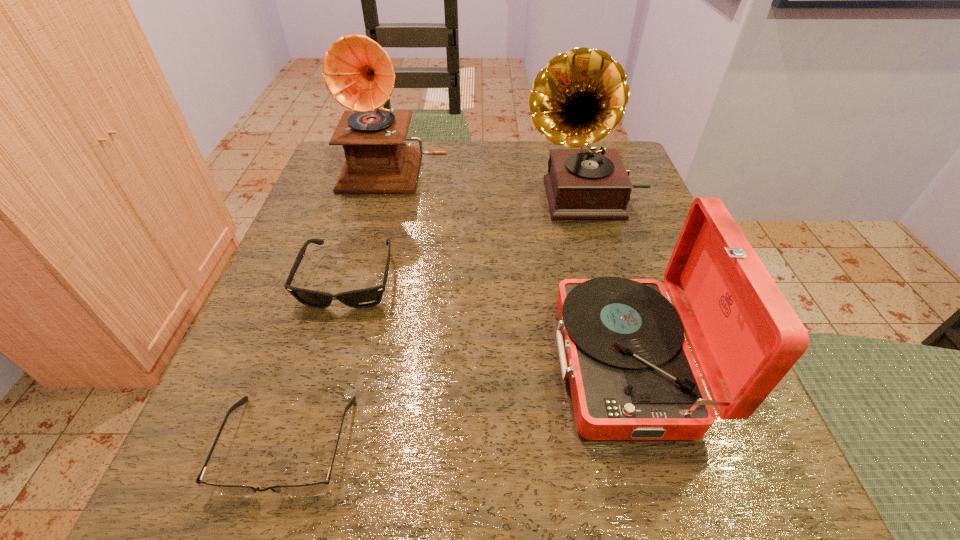
The height and width of the screenshot is (540, 960). Identify the location of free space at the near edge of the desktop. (495, 459).

Identify the location of free region at the left edge of the desktop. This screenshot has width=960, height=540. (326, 289).

At what (x,y) coordinates should I click in order to perform the action: click on vacant space at the right edge. Please return your answer as a coordinate pair (x, y). Image resolution: width=960 pixels, height=540 pixels. Looking at the image, I should click on (609, 248).

Where is `vacant space at the near left corner of the desktop`? Image resolution: width=960 pixels, height=540 pixels. vacant space at the near left corner of the desktop is located at coordinates (283, 450).

The width and height of the screenshot is (960, 540). In the image, there is a desktop. Identify the location of vacant area at the near right corner. (717, 485).

Locate an element on the screen. Image resolution: width=960 pixels, height=540 pixels. unoccupied area between the shortest phonograph_record and the shortest object is located at coordinates (457, 404).

Locate an element on the screen. blank region between the nearest phonograph_record and the spectacles is located at coordinates (457, 404).

You are a GUI agent. You are given a task and a screenshot of the screen. Output one action in this format:
    pyautogui.click(x=<x>, y=<y>)
    Task: Click on the free space that is in between the leftmost phonograph_record and the spectacles
    The width and height of the screenshot is (960, 540).
    Given the screenshot: What is the action you would take?
    pyautogui.click(x=342, y=307)

Identify which object is located as the nearest to the leftmost phonograph_record. Please provide its 2D coordinates. Your answer should be formatted as a tuple, i.e. [(x, y)], where the tuple contains the x and y coordinates of a point satisfying the conditions above.

[(580, 96)]

I want to click on object that stands as the fourth closest to the leftmost phonograph_record, so click(315, 489).